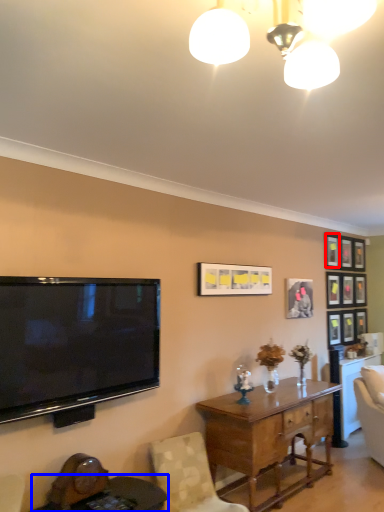
Question: Which point is closer to the camera, picture frame (highlighted by a red box) or round table (highlighted by a blue box)?

Choices:
 (A) picture frame
 (B) round table

Answer: (B)